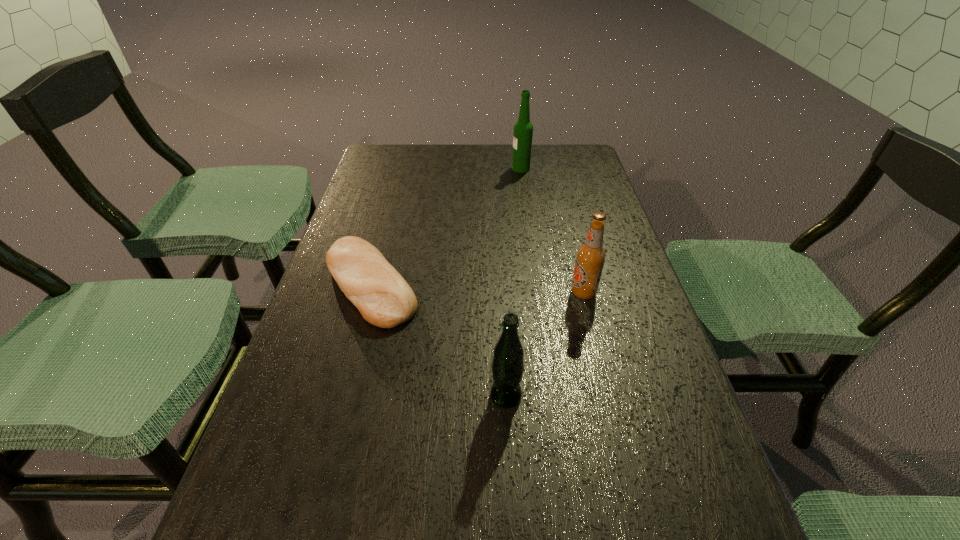
This screenshot has height=540, width=960. Find the location of `vacant space that is in between the farthest object and the second nearest beer bottle`. vacant space that is in between the farthest object and the second nearest beer bottle is located at coordinates [552, 231].

The width and height of the screenshot is (960, 540). What are the coordinates of `empty space that is in between the bread and the leftmost beer bottle` in the screenshot? It's located at (439, 340).

The image size is (960, 540). Identify the location of vacant space in between the leftmost beer bottle and the leftmost object. (439, 340).

You are a GUI agent. You are given a task and a screenshot of the screen. Output one action in this format:
    pyautogui.click(x=<x>, y=<y>)
    Task: Click on the vacant point located between the second object from left to right and the farthest beer bottle
    This screenshot has height=540, width=960.
    Given the screenshot: What is the action you would take?
    pyautogui.click(x=514, y=282)

Choose which object is the nearest neighbor to the leftmost beer bottle. Please provide its 2D coordinates. Your answer should be formatted as a tuple, i.e. [(x, y)], where the tuple contains the x and y coordinates of a point satisfying the conditions above.

[(383, 297)]

This screenshot has width=960, height=540. In order to click on object that can be found as the second closest to the farthest beer bottle in this screenshot , I will do `click(590, 257)`.

This screenshot has width=960, height=540. In order to click on the closest beer bottle to the second object from left to right in this screenshot , I will do `click(590, 257)`.

In order to click on the second closest beer bottle to the nearest beer bottle in this screenshot , I will do `click(523, 129)`.

Identify the location of vacant region that satisfies the following two spatial constraints: 1. on the label of the farthest beer bottle; 2. on the front side of the nearest object. (553, 396).